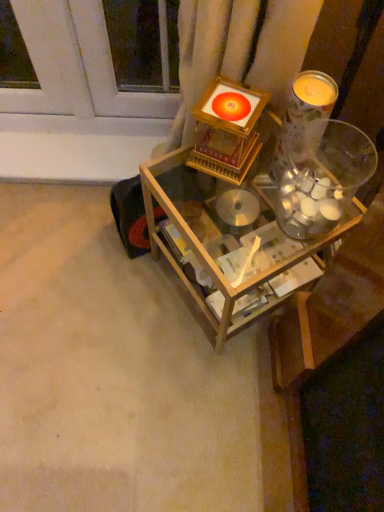
Question: Is point (266, 234) closer or farther from the camera than point (312, 90)?

Choices:
 (A) closer
 (B) farther

Answer: (B)

Question: In terms of width, does wooden table at center look wider or thinner when compared to translucent glass candle at upper right?

Choices:
 (A) wide
 (B) thin

Answer: (A)

Question: Considering the real-world distances, which object is closest to the wooden table at center?

Choices:
 (A) translucent glass candle at upper right
 (B) clear glass jar at upper right

Answer: (B)

Question: Based on their relative distances, which object is farther from the wooden table at center?

Choices:
 (A) translucent glass candle at upper right
 (B) clear glass jar at upper right

Answer: (A)